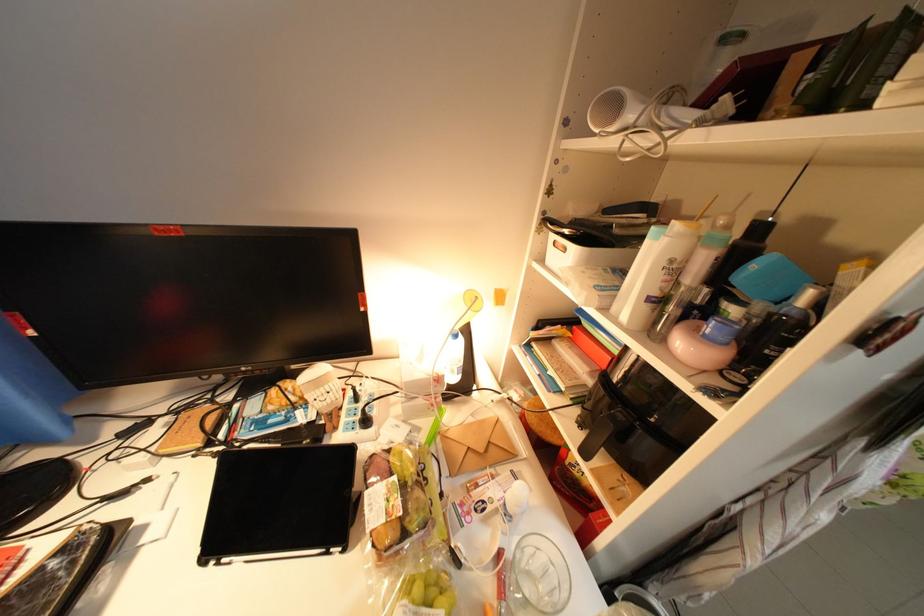
The width and height of the screenshot is (924, 616). What are the coordinates of `air fryer handle` in the screenshot? It's located at [x=690, y=114].